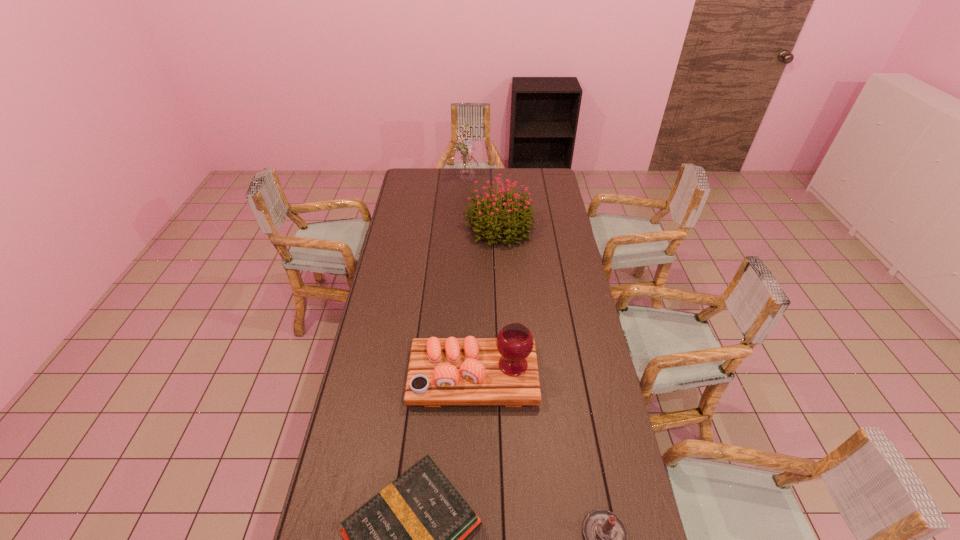
Where is `vacant space at the left edge of the desktop`? vacant space at the left edge of the desktop is located at coordinates (320, 538).

This screenshot has height=540, width=960. In order to click on vacant space at the right edge in this screenshot , I will do `click(567, 392)`.

Identify the location of free space at the far left corner. Image resolution: width=960 pixels, height=540 pixels. 428,176.

Where is `free space between the third tallest object and the farther bouquet`? free space between the third tallest object and the farther bouquet is located at coordinates (470, 277).

This screenshot has width=960, height=540. In order to click on empty location between the third farthest object and the farthest object in this screenshot , I will do `click(470, 277)`.

The width and height of the screenshot is (960, 540). I want to click on vacant point located between the platter and the fourth shortest object, so click(487, 301).

This screenshot has width=960, height=540. In order to click on empty space between the platter and the second tallest object in this screenshot , I will do `click(487, 301)`.

Locate an element on the screen. This screenshot has height=540, width=960. free spot between the platter and the farthest object is located at coordinates (470, 277).

Identify which object is located as the nearest to the hardback book. Please provide its 2D coordinates. Your answer should be formatted as a tuple, i.e. [(x, y)], where the tuple contains the x and y coordinates of a point satisfying the conditions above.

[(503, 371)]

The width and height of the screenshot is (960, 540). I want to click on the third closest object to the farther bouquet, so click(410, 539).